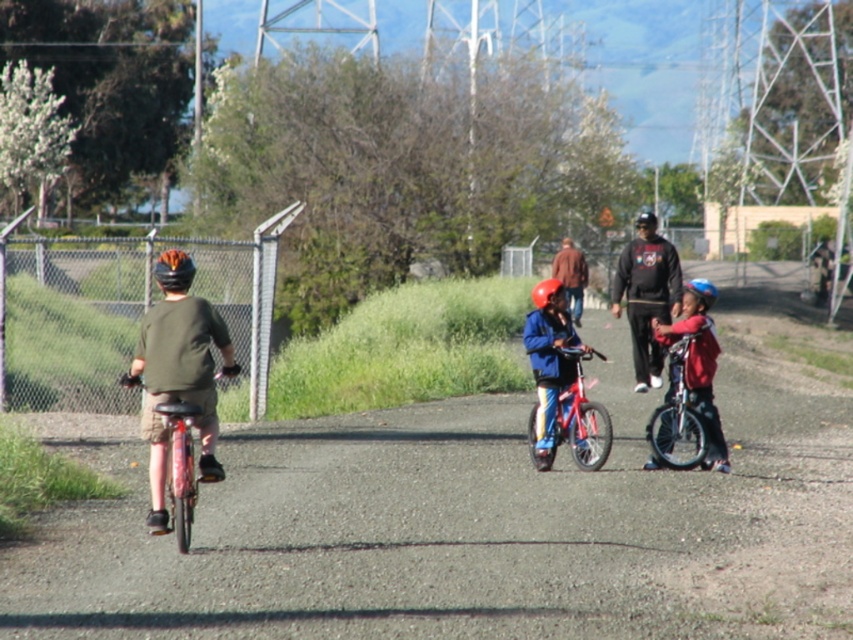
You are a cyclist trying to pass through a narrow pathway that is only wide enough for one bicycle. You see the shiny red bicycle at center and the orange matte helmet at rear. Which object should you avoid hitting if you want to navigate safely through the narrow path?

You should avoid hitting the shiny red bicycle at center because it is wider than the orange matte helmet at rear, making it more likely to block your path in the narrow pathway.